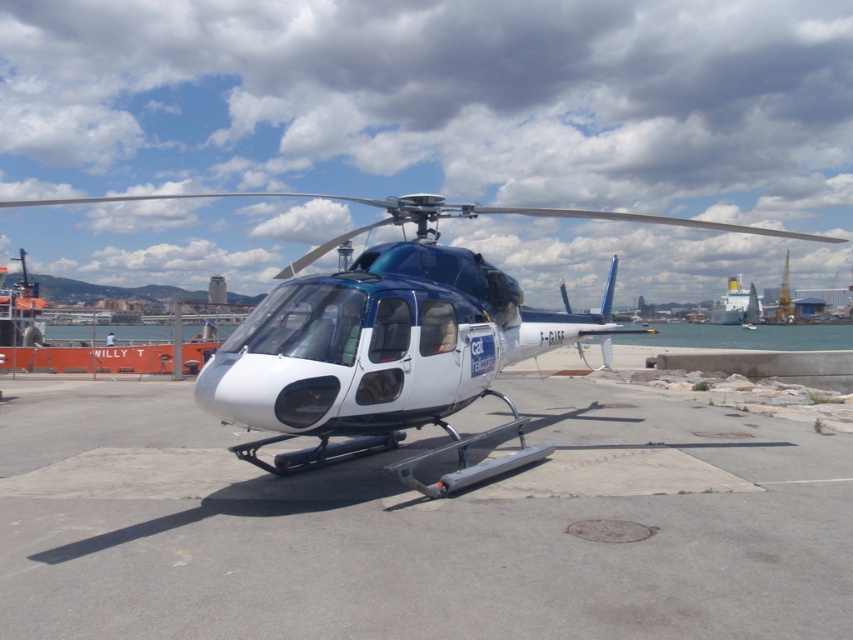
Question: Which object is the closest to the white glossy ship at right?

Choices:
 (A) white glossy helicopter at center
 (B) white concrete tarmac at center

Answer: (A)

Question: Observing the image, what is the correct spatial positioning of white concrete tarmac at center in reference to white glossy helicopter at center?

Choices:
 (A) right
 (B) left

Answer: (A)

Question: Can you confirm if white concrete tarmac at center is smaller than white glossy ship at right?

Choices:
 (A) no
 (B) yes

Answer: (B)

Question: Considering the relative positions of white concrete tarmac at center and white glossy helicopter at center in the image provided, where is white concrete tarmac at center located with respect to white glossy helicopter at center?

Choices:
 (A) above
 (B) below

Answer: (B)

Question: Which point is closer to the camera?

Choices:
 (A) white concrete tarmac at center
 (B) white glossy helicopter at center

Answer: (A)

Question: Which point is farther from the camera taking this photo?

Choices:
 (A) (747, 291)
 (B) (123, 388)
 (C) (344, 400)

Answer: (A)